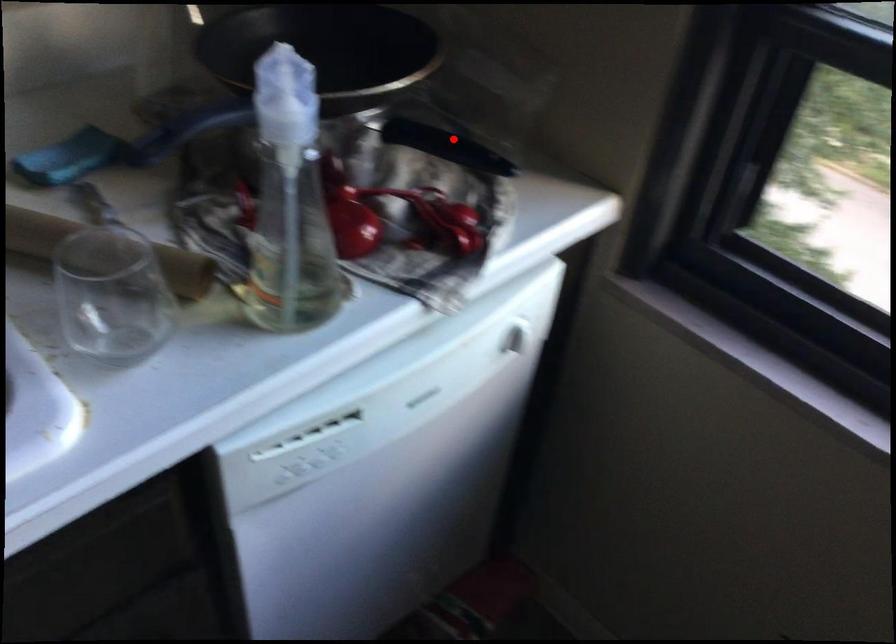
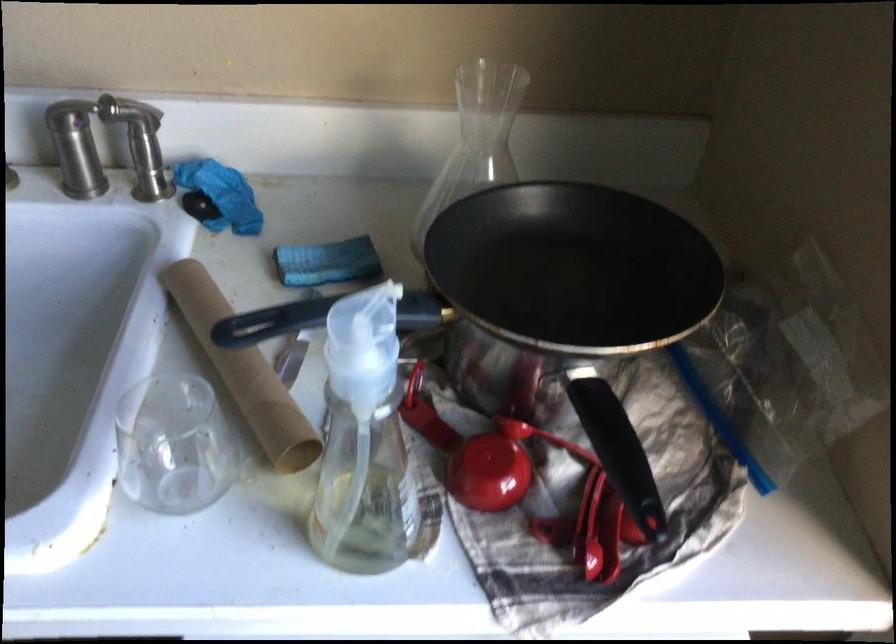
Locate, in the second image, the point that corresponds to the highlighted location in the first image.

(618, 451)